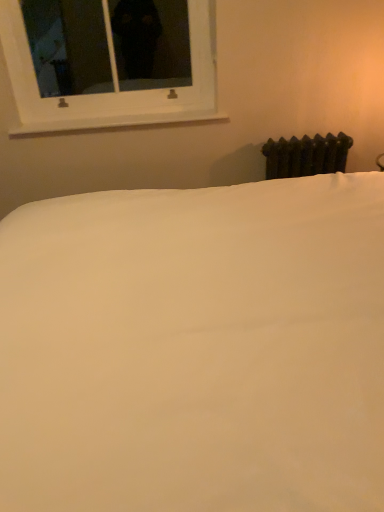
Question: From the image's perspective, is white plastic window at upper left located above or below white smooth bed at center?

Choices:
 (A) above
 (B) below

Answer: (A)

Question: Which is correct: white plastic window at upper left is inside white smooth bed at center, or outside of it?

Choices:
 (A) inside
 (B) outside

Answer: (B)

Question: Which of these objects is positioned closest to the dark green cast iron radiator at right?

Choices:
 (A) white smooth window sill at upper center
 (B) white plastic window at upper left
 (C) white smooth bed at center

Answer: (A)

Question: Which is farther from the white smooth window sill at upper center?

Choices:
 (A) white plastic window at upper left
 (B) dark green cast iron radiator at right
 (C) white smooth bed at center

Answer: (C)